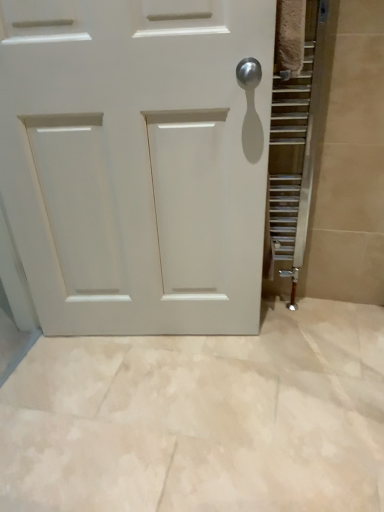
The width and height of the screenshot is (384, 512). In order to click on free location to the left of white matte door at center in this screenshot , I will do `click(62, 375)`.